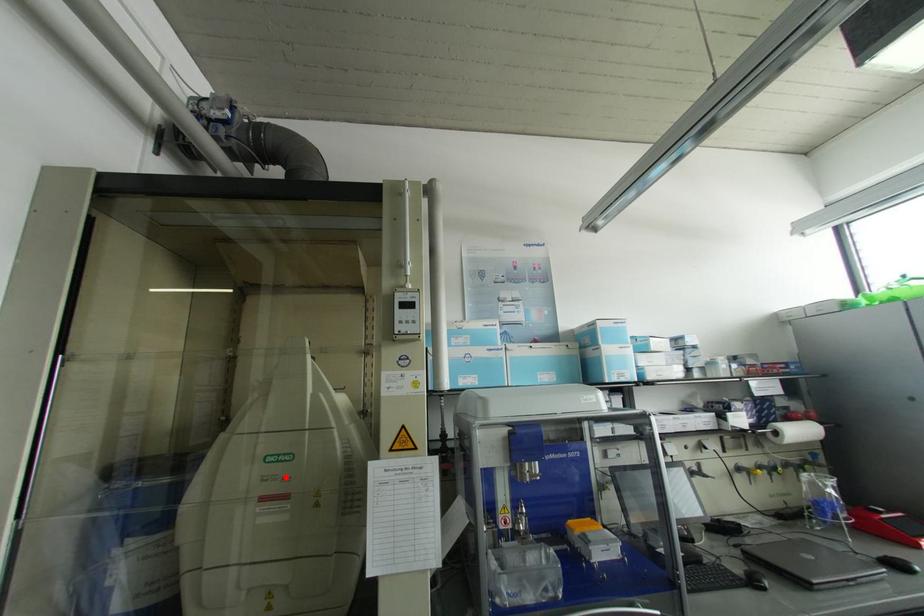
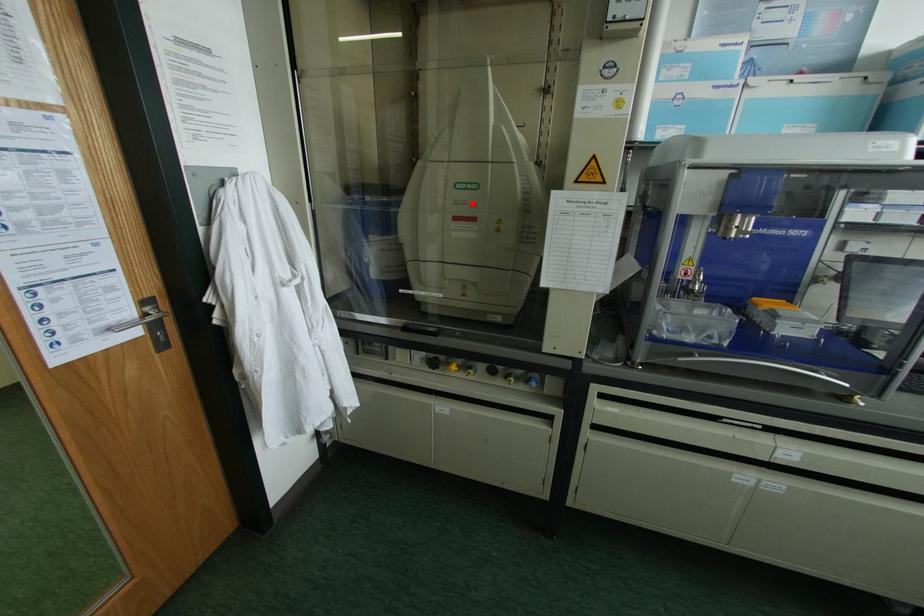
I am providing you with two images of the same scene from different viewpoints. A red point is marked on the first image and another point is marked on the second image. Is the red point in image1 aligned with the point shown in image2?

Yes